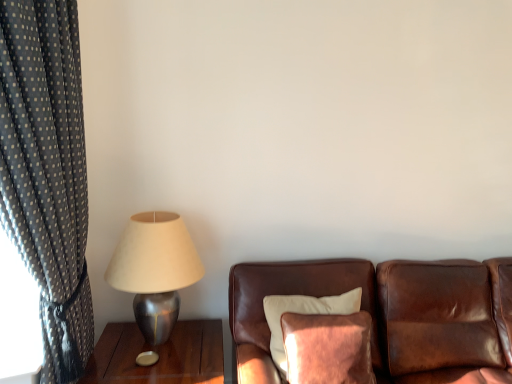
Question: Visually, is metallic silver table at left positioned to the left or to the right of brown leather couch at center?

Choices:
 (A) right
 (B) left

Answer: (B)

Question: From the image's perspective, is metallic silver table at left above or below brown leather couch at center?

Choices:
 (A) above
 (B) below

Answer: (B)

Question: Which object is the farthest from the metallic silver table at left?

Choices:
 (A) brown leather couch at center
 (B) velvet brown pillow at center
 (C) dark gray polka dot fabric at left
 (D) metallic silver lamp at left

Answer: (C)

Question: Estimate the real-world distances between objects in this image. Which object is farther from the metallic silver lamp at left?

Choices:
 (A) metallic silver table at left
 (B) brown leather couch at center
 (C) velvet brown pillow at center
 (D) dark gray polka dot fabric at left

Answer: (B)